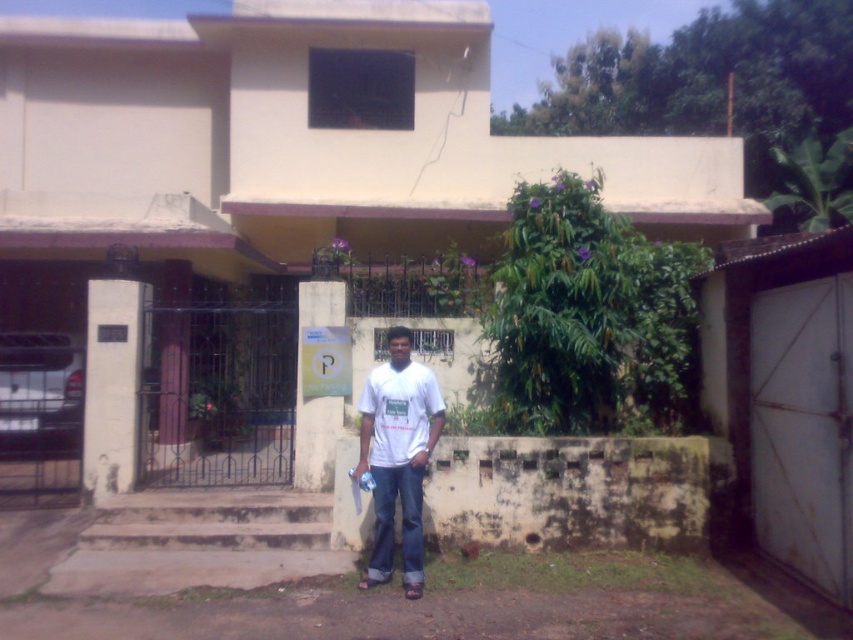
You are standing in front of the residential building and want to enter. Where are the concrete stairs at center located in relation to the entrance?

The concrete stairs at center are located at point (199,541) in 2D coordinates.